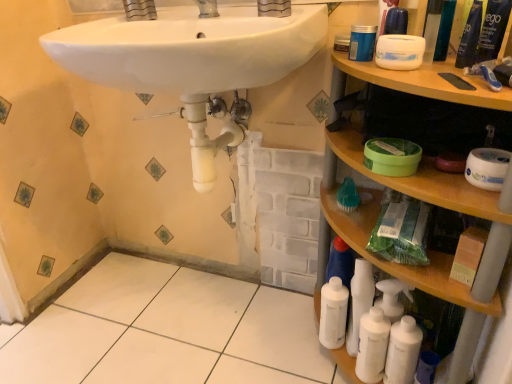
Image resolution: width=512 pixels, height=384 pixels. I want to click on free spot to the right of white matte container at upper right, which is counted as the second toilet paper, starting from the right, so click(454, 67).